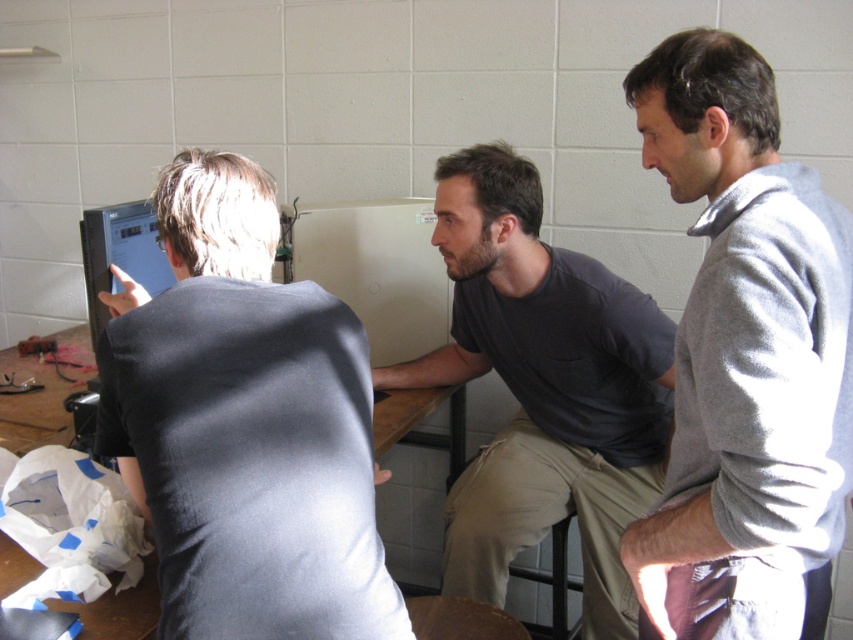
Question: Is gray sweater at upper right above dark gray shirt at center?

Choices:
 (A) no
 (B) yes

Answer: (B)

Question: Which point is farther to the camera?

Choices:
 (A) dark gray shirt at center
 (B) gray sweater at upper right

Answer: (A)

Question: Can you confirm if matte gray shirt at left is smaller than dark gray shirt at center?

Choices:
 (A) no
 (B) yes

Answer: (B)

Question: Is matte gray shirt at left wider than dark gray shirt at center?

Choices:
 (A) no
 (B) yes

Answer: (A)

Question: Which of the following is the farthest from the observer?

Choices:
 (A) matte gray shirt at left
 (B) dark gray shirt at center
 (C) gray sweater at upper right

Answer: (B)

Question: Which point appears farthest from the camera in this image?

Choices:
 (A) (704, 436)
 (B) (236, 552)

Answer: (A)